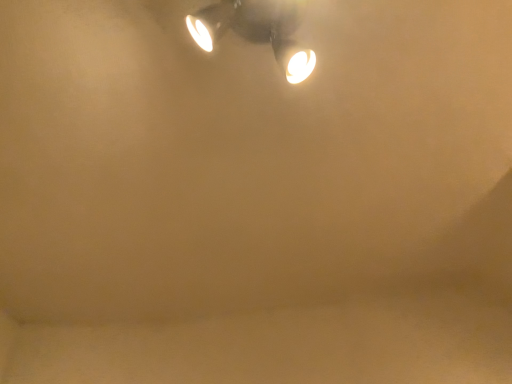
Describe the element at coordinates (256, 30) in the screenshot. I see `matte black lamp at upper center` at that location.

Find the location of `matte black lamp at upper center`. matte black lamp at upper center is located at coordinates (256, 30).

Measure the distance between point (264, 24) and camera.

The distance of point (264, 24) from camera is 39.06 inches.

Where is `matte black lamp at upper center`? This screenshot has width=512, height=384. matte black lamp at upper center is located at coordinates (256, 30).